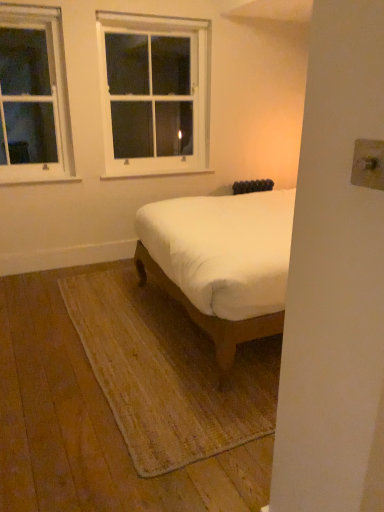
Question: Looking at the image, does white wood window at upper left, which is counted as the second window, starting from the right, seem bigger or smaller compared to white wood window at upper center, the first window from the right?

Choices:
 (A) small
 (B) big

Answer: (A)

Question: Does point (39, 164) appear closer or farther from the camera than point (160, 54)?

Choices:
 (A) closer
 (B) farther

Answer: (A)

Question: Which object is the closest to the white wood window at upper center, the first window from the right?

Choices:
 (A) white fabric bed at center
 (B) white wood window at upper left, acting as the 1th window starting from the left

Answer: (B)

Question: Which object is positioned closest to the white wood window at upper left, which is counted as the second window, starting from the right?

Choices:
 (A) white fabric bed at center
 (B) white wood window at upper center, the 2th window positioned from the left

Answer: (B)